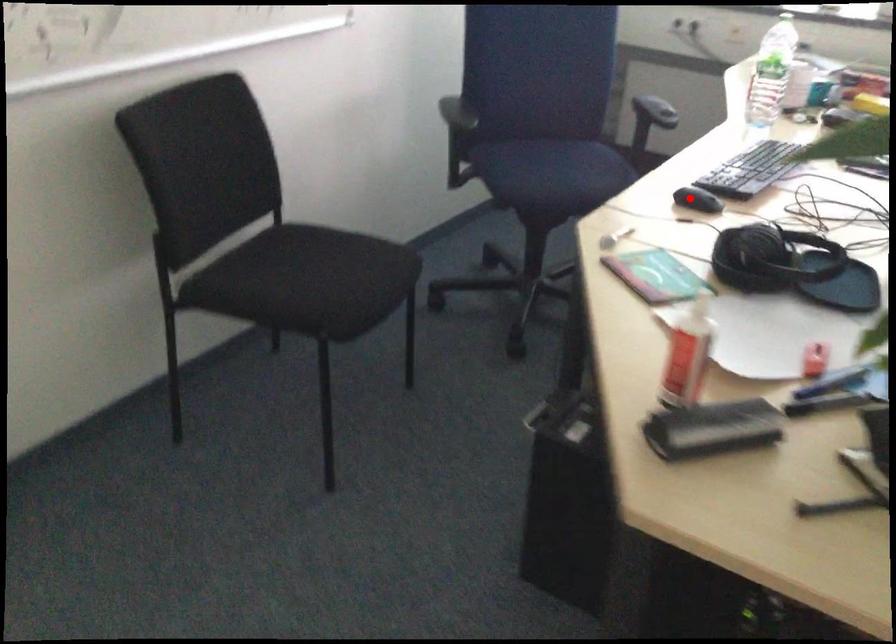
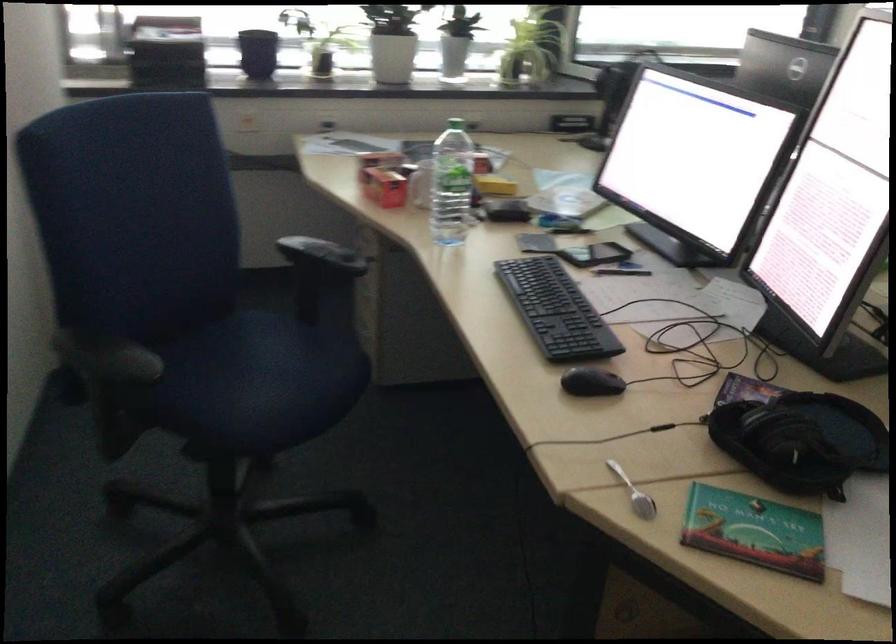
Question: I am providing you with two images of the same scene from different viewpoints. Given a red point in image1, look at the same physical point in image2. Is it:

Choices:
 (A) Closer to the viewpoint
 (B) Farther from the viewpoint

Answer: (A)